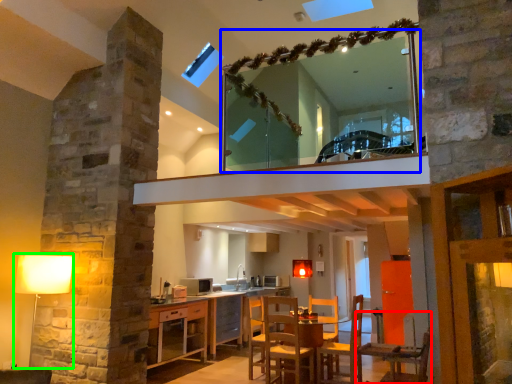
Question: Estimate the real-world distances between objects in this image. Which object is closer to chair (highlighted by a red box), mirror (highlighted by a blue box) or table lamp (highlighted by a green box)?

Choices:
 (A) mirror
 (B) table lamp

Answer: (B)